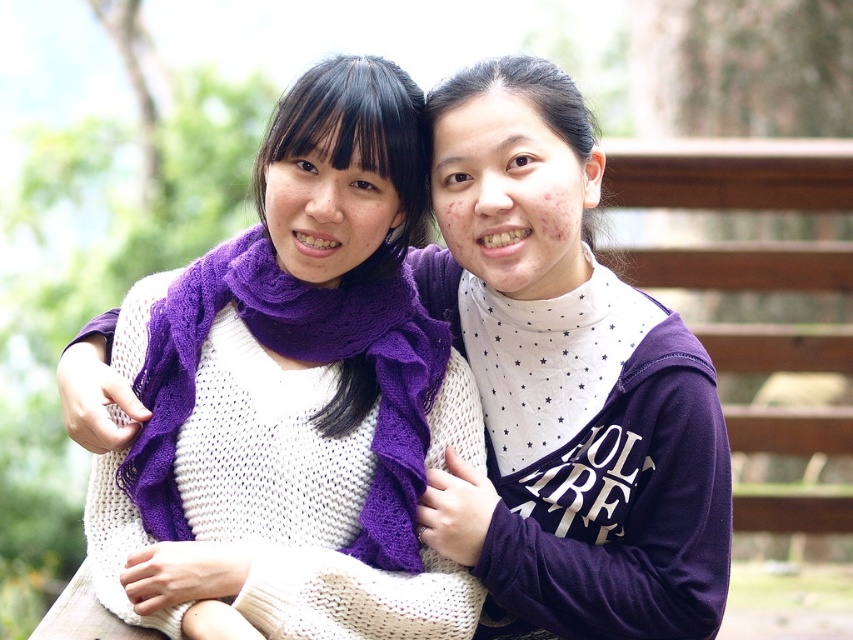
Between purple knitted scarf at center and purple knit sweater at center, which one is positioned lower?

Positioned lower is purple knit sweater at center.

Measure the distance between point (262, 284) and camera.

12.79 feet

Between point (321, 108) and point (701, 417), which one is positioned in front?

Point (321, 108) is more forward.

This screenshot has height=640, width=853. I want to click on purple knitted scarf at center, so click(x=293, y=397).

In the scene shown: Who is more distant from viewer, (346, 326) or (305, 326)?

The point (346, 326) is more distant.

Can you confirm if purple knitted scarf at center is smaller than purple knitted scarf at left?

Actually, purple knitted scarf at center might be larger than purple knitted scarf at left.

Who is more distant from viewer, (171, 384) or (424, 451)?

The point (424, 451) is behind.

Identify the location of purple knitted scarf at center. The height and width of the screenshot is (640, 853). (293, 397).

What do you see at coordinates (567, 387) in the screenshot?
I see `purple knit sweater at center` at bounding box center [567, 387].

Is purple knit sweater at center further to the viewer compared to purple knitted scarf at left?

Yes, purple knit sweater at center is further from the viewer.

Is point (579, 397) positioned in front of point (132, 472)?

No, (579, 397) is further to viewer.

Find the location of `purple knit sweater at center`. purple knit sweater at center is located at coordinates (567, 387).